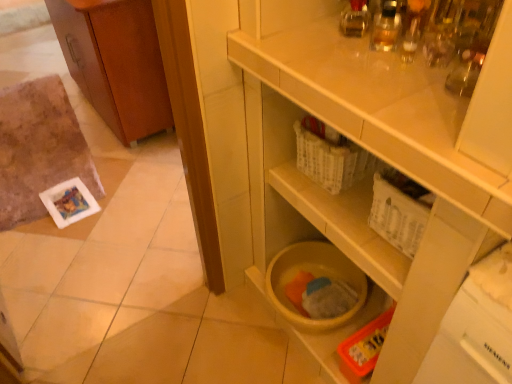
Identify the location of yellow matte plastic bucket at lower center. The width and height of the screenshot is (512, 384). (376, 155).

This screenshot has width=512, height=384. I want to click on white plastic drawer at upper right, so click(425, 169).

Identify the location of wooden cabinet at left. (115, 62).

From the image's perspective, is yellow matte plastic bucket at lower center positioned above or below white plastic drawer at upper right?

Based on their image positions, yellow matte plastic bucket at lower center is located beneath white plastic drawer at upper right.

Considering the sizes of yellow matte plastic bucket at lower center and white plastic drawer at upper right in the image, is yellow matte plastic bucket at lower center bigger or smaller than white plastic drawer at upper right?

yellow matte plastic bucket at lower center is bigger than white plastic drawer at upper right.

From a real-world perspective, is yellow matte plastic bucket at lower center physically above white plastic drawer at upper right?

No, from a real-world perspective, yellow matte plastic bucket at lower center is not over white plastic drawer at upper right

Is yellow matte plastic bucket at lower center inside the boundaries of white plastic drawer at upper right, or outside?

yellow matte plastic bucket at lower center is located beyond the bounds of white plastic drawer at upper right.

From a real-world perspective, is yellow matte plastic bucket at lower center located beneath wooden cabinet at left?

No, from a real-world perspective, yellow matte plastic bucket at lower center is not under wooden cabinet at left.

Choose the correct answer: Is yellow matte plastic bucket at lower center inside wooden cabinet at left or outside it?

The correct answer is: outside.

Is yellow matte plastic bucket at lower center facing away from wooden cabinet at left?

No, yellow matte plastic bucket at lower center is not facing away from wooden cabinet at left.

Considering the relative sizes of yellow matte plastic bucket at lower center and wooden cabinet at left in the image provided, is yellow matte plastic bucket at lower center bigger than wooden cabinet at left?

Yes, yellow matte plastic bucket at lower center is bigger than wooden cabinet at left.

Who is smaller, wooden cabinet at left or yellow matte plastic bucket at lower center?

With smaller size is wooden cabinet at left.

Which of these two, wooden cabinet at left or yellow matte plastic bucket at lower center, stands taller?

yellow matte plastic bucket at lower center is taller.

Based on the photo, is yellow matte plastic bucket at lower center located within wooden cabinet at left?

No, yellow matte plastic bucket at lower center is not a part of wooden cabinet at left.

From a real-world perspective, is wooden cabinet at left beneath yellow matte plastic bucket at lower center?

Yes, from a real-world perspective, wooden cabinet at left is under yellow matte plastic bucket at lower center.

From the picture: Which is closer, [401,142] or [457,289]?

Point [401,142].

Would you say white plastic drawer at upper right contains yellow matte plastic bucket at lower center?

No, yellow matte plastic bucket at lower center is not inside white plastic drawer at upper right.

Between white plastic drawer at upper right and yellow matte plastic bucket at lower center, which one appears on the right side from the viewer's perspective?

white plastic drawer at upper right.

Is white plastic drawer at upper right closer to the viewer compared to yellow matte plastic bucket at lower center?

No, white plastic drawer at upper right is further to the viewer.

Considering the positions of objects white plastic drawer at upper right and wooden cabinet at left in the image provided, who is behind, white plastic drawer at upper right or wooden cabinet at left?

wooden cabinet at left is more distant.

Does point (450, 188) come farther from viewer compared to point (157, 88)?

No, (450, 188) is in front of (157, 88).

Consider the image. Can you confirm if white plastic drawer at upper right is wider than wooden cabinet at left?

No, white plastic drawer at upper right is not wider than wooden cabinet at left.

Is wooden cabinet at left oriented towards white plastic drawer at upper right?

No, wooden cabinet at left is not aimed at white plastic drawer at upper right.

In the scene shown: From a real-world perspective, which object rests below the other?

wooden cabinet at left.

Image resolution: width=512 pixels, height=384 pixels. I want to click on cupboard that appears in front of the white plastic drawer at upper right, so click(376, 155).

Locate an element on the screen. cabinetry behind the yellow matte plastic bucket at lower center is located at coordinates (115, 62).

Looking at the image, which one is located closer to wooden cabinet at left, yellow matte plastic bucket at lower center or white plastic drawer at upper right?

yellow matte plastic bucket at lower center.

Based on their spatial positions, is white plastic drawer at upper right or wooden cabinet at left closer to yellow matte plastic bucket at lower center?

white plastic drawer at upper right.

When comparing their distances from white plastic drawer at upper right, does yellow matte plastic bucket at lower center or wooden cabinet at left seem further?

wooden cabinet at left is further to white plastic drawer at upper right.

From the image, which object appears to be farther from yellow matte plastic bucket at lower center, wooden cabinet at left or white plastic drawer at upper right?

wooden cabinet at left is further to yellow matte plastic bucket at lower center.

Looking at the image, which one is located closer to white plastic drawer at upper right, wooden cabinet at left or yellow matte plastic bucket at lower center?

The object closer to white plastic drawer at upper right is yellow matte plastic bucket at lower center.

Which object lies nearer to the anchor point wooden cabinet at left, white plastic drawer at upper right or yellow matte plastic bucket at lower center?

Based on the image, yellow matte plastic bucket at lower center appears to be nearer to wooden cabinet at left.

At what (x,y) coordinates should I click in order to perform the action: click on cupboard between wooden cabinet at left and white plastic drawer at upper right from left to right. Please return your answer as a coordinate pair (x, y). Looking at the image, I should click on (376, 155).